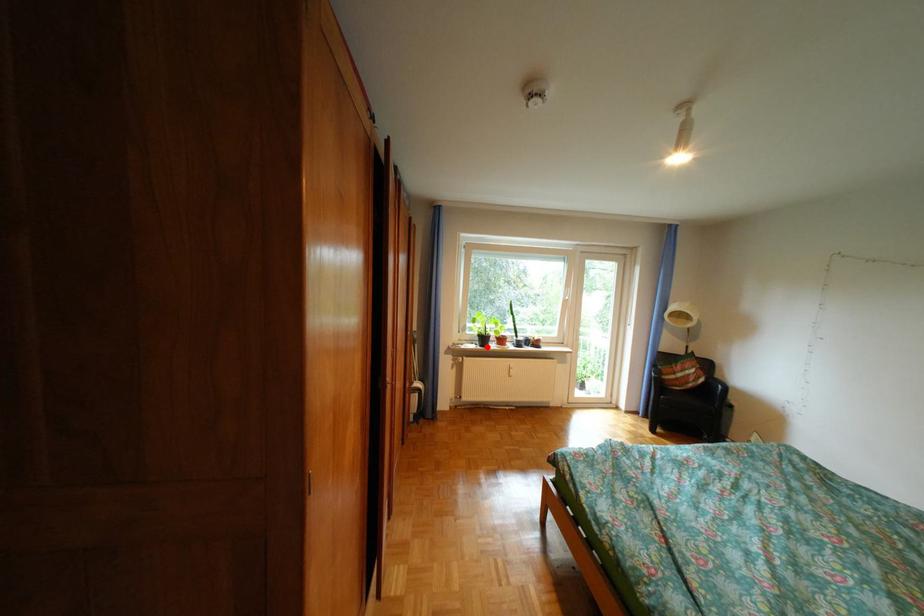
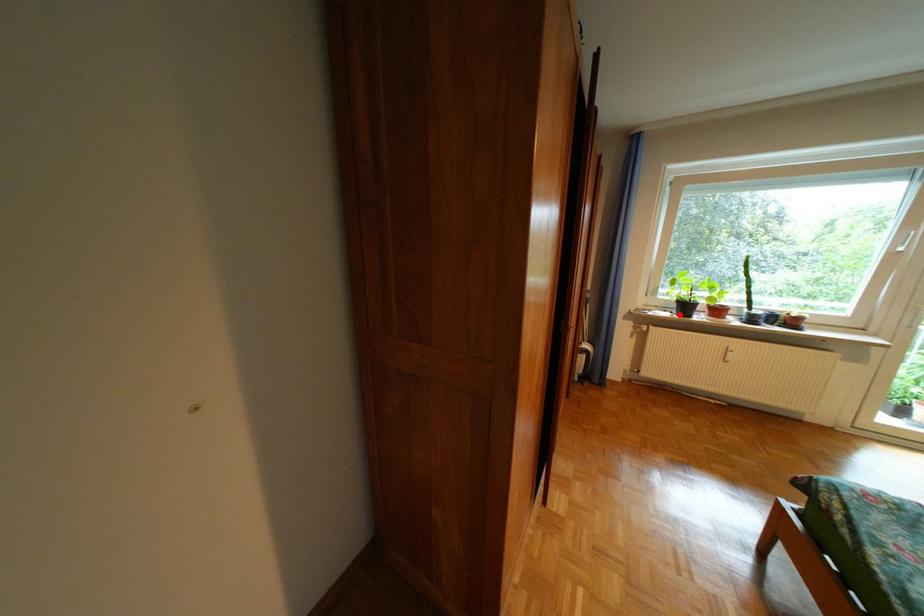
I am providing you with two images of the same scene from different viewpoints. A red point is marked on the first image and another point is marked on the second image. Does the point marked in image1 correspond to the same location as the one in image2?

Yes